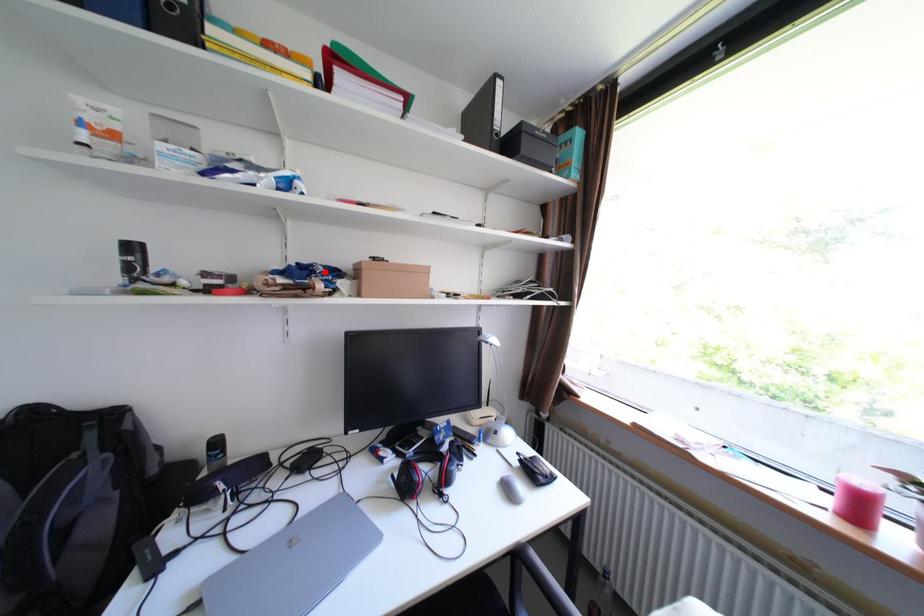
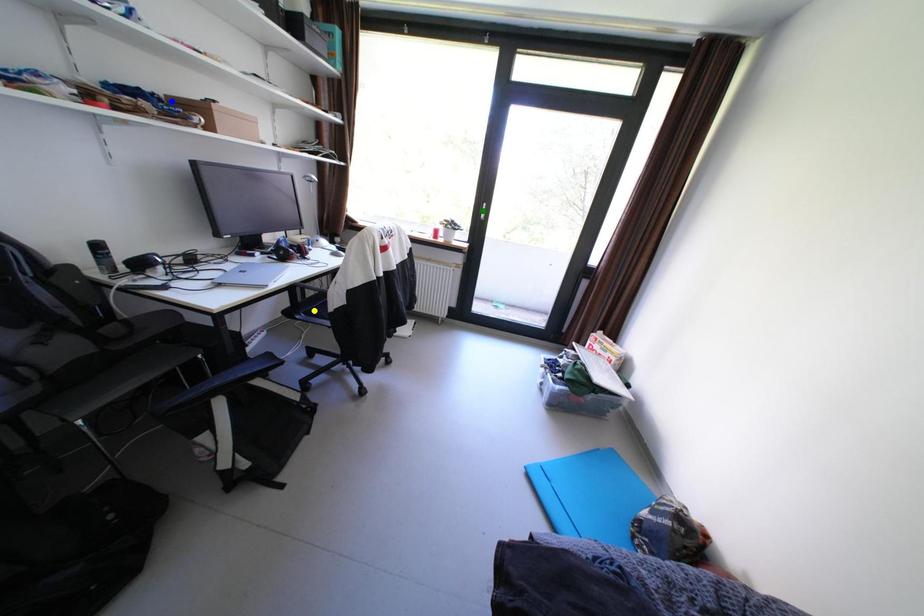
Question: I am providing you with two images of the same scene from different viewpoints. A red point is marked on the first image. You are given multiple points on the second image. Which spot in image 2 lines up with the point in image 1?

Choices:
 (A) blue point
 (B) yellow point
 (C) green point

Answer: (A)